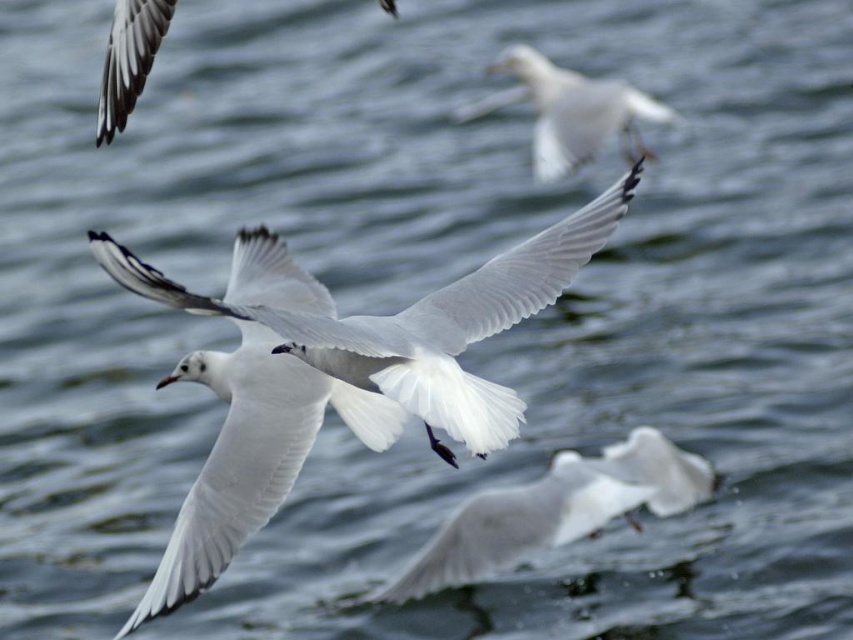
Question: Where is white matte bird at upper center located in relation to white matte wing at upper left in the image?

Choices:
 (A) above
 (B) below

Answer: (A)

Question: Is white feathered bird at center to the right of white matte bird at upper center from the viewer's perspective?

Choices:
 (A) no
 (B) yes

Answer: (A)

Question: Which of the following is the closest to the observer?

Choices:
 (A) white feathered bird at center
 (B) white matte wing at upper left
 (C) white matte bird at upper center

Answer: (B)

Question: Does white feathered bird at center have a smaller size compared to white matte bird at upper center?

Choices:
 (A) yes
 (B) no

Answer: (A)

Question: Considering the real-world distances, which object is farthest from the white matte wing at upper left?

Choices:
 (A) white matte bird at upper center
 (B) white feathered bird at center

Answer: (A)

Question: Which object is positioned farthest from the white feathered bird at center?

Choices:
 (A) white matte bird at upper center
 (B) white matte wing at upper left

Answer: (B)